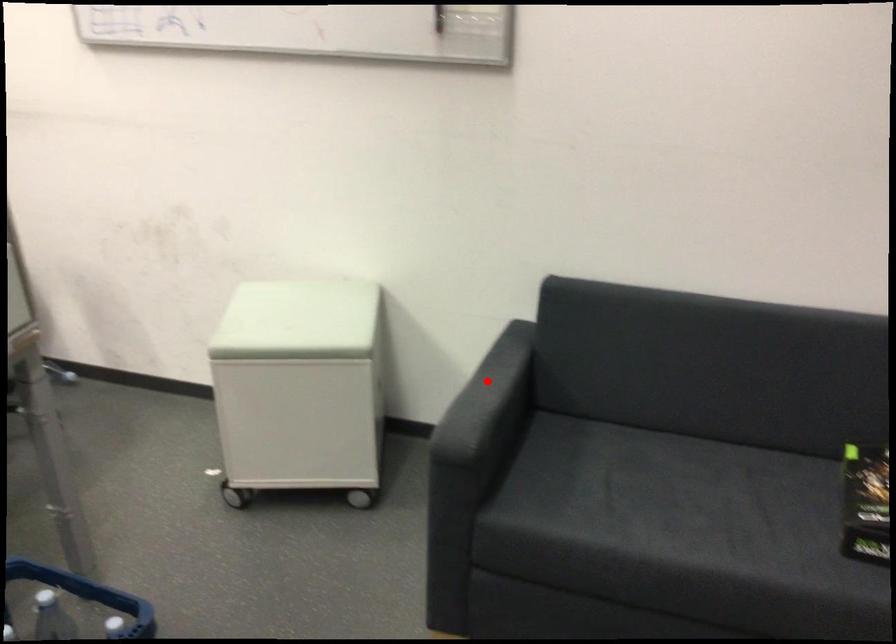
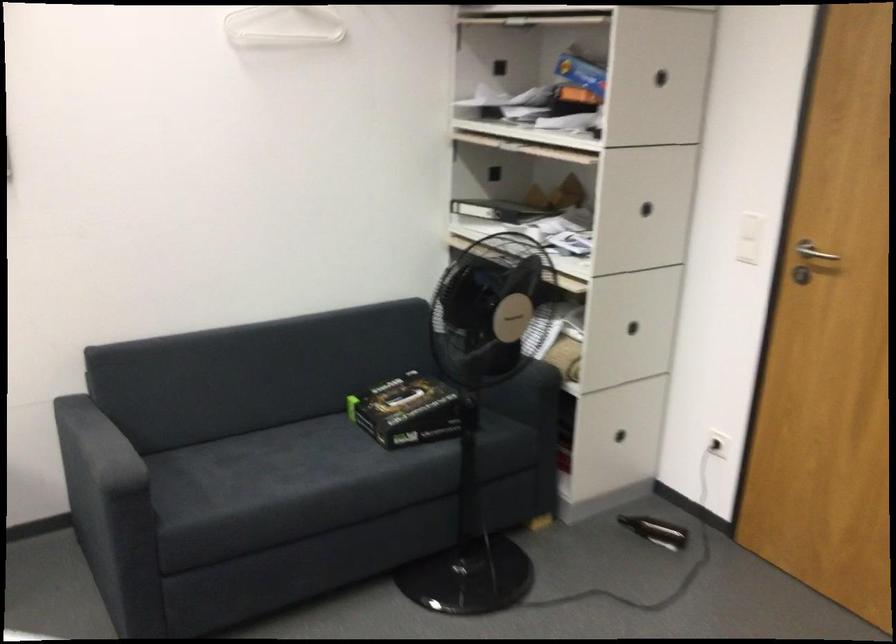
In the second image, find the point that corresponds to the highlighted location in the first image.

(93, 440)